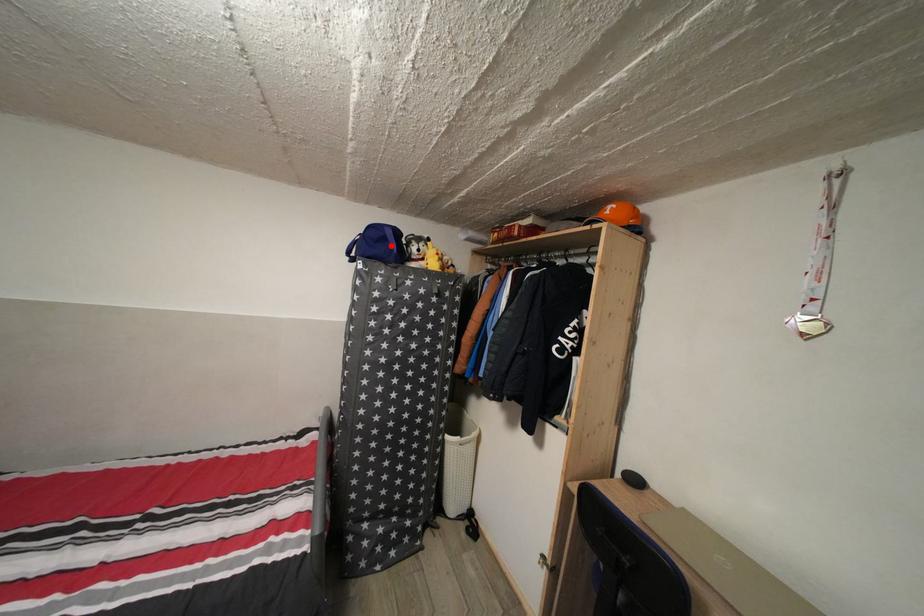
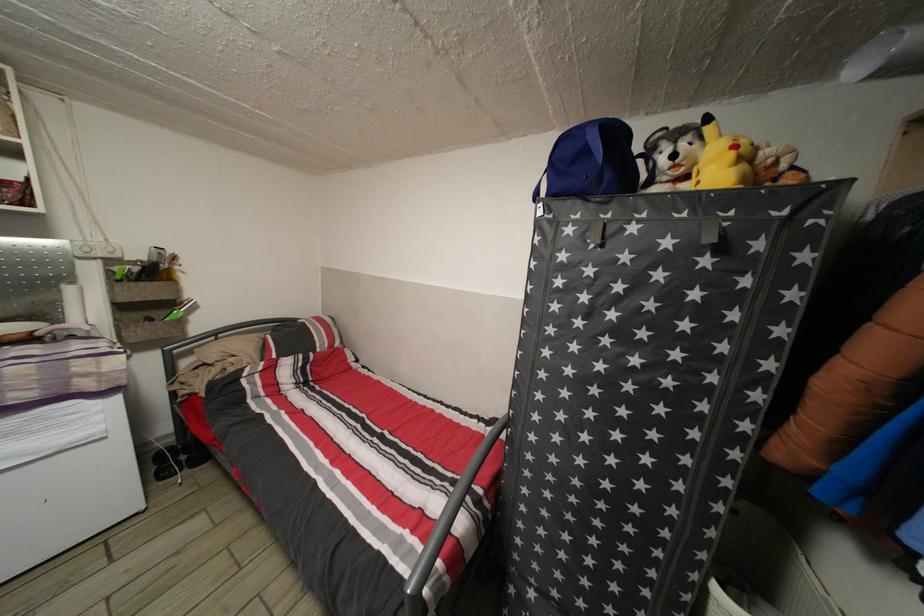
Where in the second image is the point corresponding to the highlighted location from the first image?

(591, 158)